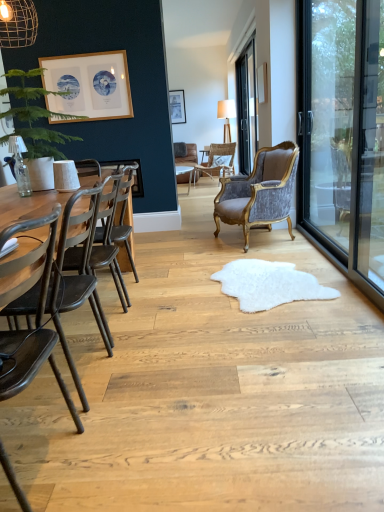
Locate an element on the screen. The width and height of the screenshot is (384, 512). free space above wooden framed artwork at upper left, which is the third picture frame in top-to-bottom order (from a real-world perspective) is located at coordinates (x=82, y=53).